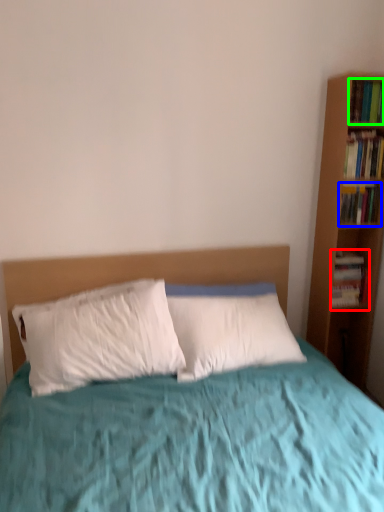
Question: Which is farther away from book (highlighted by a red box)? book (highlighted by a blue box) or book (highlighted by a green box)?

Choices:
 (A) book
 (B) book

Answer: (B)